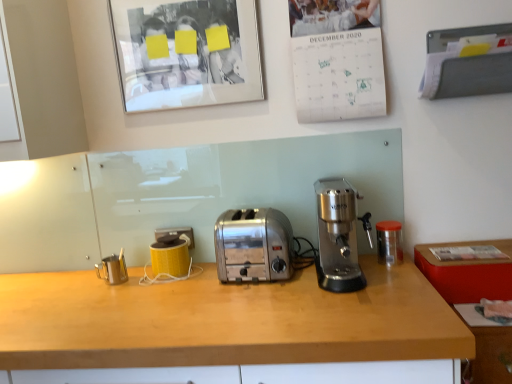
This screenshot has width=512, height=384. Describe the element at coordinates (170, 255) in the screenshot. I see `yellow matte mug at center, the second appliance in the left-to-right sequence` at that location.

Describe the element at coordinates (389, 242) in the screenshot. I see `transparent plastic container at right, arranged as the 1th appliance when viewed from the right` at that location.

The width and height of the screenshot is (512, 384). I want to click on yellow plastic electric outlet at lower left, so click(x=176, y=233).

From a real-world perspective, is satin silver coffee maker at center above or below wooden desk at center?

satin silver coffee maker at center is above wooden desk at center.

Can you tell me how much satin silver coffee maker at center and wooden desk at center differ in facing direction?

They differ by 0.000156 degrees in their facing directions.

Is satin silver coffee maker at center beside wooden desk at center?

satin silver coffee maker at center is not next to wooden desk at center, and they're not touching.

Would you say matte glass picture frame at upper left contains wooden desk at center?

No.

Where is `picture frame on the right of wooden desk at center`? This screenshot has height=384, width=512. picture frame on the right of wooden desk at center is located at coordinates 186,52.

Is matte glass picture frame at upper left thinner than wooden desk at center?

Correct, the width of matte glass picture frame at upper left is less than that of wooden desk at center.

What's the angular difference between matte glass picture frame at upper left and wooden desk at center's facing directions?

0.403 degrees.

From the image's perspective, is yellow plastic electric outlet at lower left over yellow matte mug at center, the second appliance in the left-to-right sequence?

Correct, yellow plastic electric outlet at lower left appears higher than yellow matte mug at center, the second appliance in the left-to-right sequence, in the image.

Which object is positioned more to the left, yellow plastic electric outlet at lower left or yellow matte mug at center, which is the second appliance from right to left?

From the viewer's perspective, yellow plastic electric outlet at lower left appears more on the left side.

In terms of width, does yellow plastic electric outlet at lower left look wider or thinner when compared to yellow matte mug at center, which is the second appliance from right to left?

Considering their sizes, yellow plastic electric outlet at lower left looks slimmer than yellow matte mug at center, which is the second appliance from right to left.

Locate an element on the screen. coffee maker above the yellow matte mug at center, which is the second appliance from right to left (from the image's perspective) is located at coordinates (339, 236).

From a real-world perspective, is yellow matte mug at center, the second appliance in the left-to-right sequence, positioned over satin silver coffee maker at center based on gravity?

Actually, yellow matte mug at center, the second appliance in the left-to-right sequence, is physically below satin silver coffee maker at center in the real world.

Considering the relative positions of yellow matte mug at center, which is the second appliance from right to left, and satin silver coffee maker at center in the image provided, is yellow matte mug at center, which is the second appliance from right to left, to the left of satin silver coffee maker at center from the viewer's perspective?

Correct, you'll find yellow matte mug at center, which is the second appliance from right to left, to the left of satin silver coffee maker at center.

From the image's perspective, who appears lower, yellow matte mug at center, which is the second appliance from right to left, or satin silver coffee maker at center?

yellow matte mug at center, which is the second appliance from right to left, appears lower in the image.

Can you confirm if yellow matte mug at center, the second appliance in the left-to-right sequence, is wider than matte glass picture frame at upper left?

Yes, yellow matte mug at center, the second appliance in the left-to-right sequence, is wider than matte glass picture frame at upper left.

This screenshot has height=384, width=512. Find the location of `appliance that is the 2nd object located behind the matte glass picture frame at upper left`. appliance that is the 2nd object located behind the matte glass picture frame at upper left is located at coordinates point(170,255).

Looking at the image, does yellow matte mug at center, which is the second appliance from right to left, seem bigger or smaller compared to matte glass picture frame at upper left?

Clearly, yellow matte mug at center, which is the second appliance from right to left, is smaller in size than matte glass picture frame at upper left.

Relative to matte glass picture frame at upper left, is yellow matte mug at center, the second appliance in the left-to-right sequence, in front or behind?

Clearly, yellow matte mug at center, the second appliance in the left-to-right sequence, is behind matte glass picture frame at upper left.

From a real-world perspective, is transparent plastic container at right, which ranks as the 3th appliance in left-to-right order, on satin silver coffee maker at center?

Actually, transparent plastic container at right, which ranks as the 3th appliance in left-to-right order, is physically below satin silver coffee maker at center in the real world.

From the picture: Could you measure the distance between transparent plastic container at right, which ranks as the 3th appliance in left-to-right order, and satin silver coffee maker at center?

7.87 inches.

In the scene shown: Is transparent plastic container at right, arranged as the 1th appliance when viewed from the right, taller than satin silver coffee maker at center?

In fact, transparent plastic container at right, arranged as the 1th appliance when viewed from the right, may be shorter than satin silver coffee maker at center.

The image size is (512, 384). In order to click on coffee maker on the left of transparent plastic container at right, which ranks as the 3th appliance in left-to-right order in this screenshot , I will do `click(339, 236)`.

Does point (199, 53) come in front of point (378, 257)?

No.

From a real-world perspective, is matte glass picture frame at upper left physically located above or below transparent plastic container at right, arranged as the 1th appliance when viewed from the right?

From a real-world perspective, matte glass picture frame at upper left is physically above transparent plastic container at right, arranged as the 1th appliance when viewed from the right.

Who is smaller, matte glass picture frame at upper left or transparent plastic container at right, which ranks as the 3th appliance in left-to-right order?

transparent plastic container at right, which ranks as the 3th appliance in left-to-right order.

Where is `picture frame lying on the left of transparent plastic container at right, which ranks as the 3th appliance in left-to-right order`? Image resolution: width=512 pixels, height=384 pixels. picture frame lying on the left of transparent plastic container at right, which ranks as the 3th appliance in left-to-right order is located at coordinates (186, 52).

Where is `coffee maker above the wooden desk at center (from a real-world perspective)`? The width and height of the screenshot is (512, 384). coffee maker above the wooden desk at center (from a real-world perspective) is located at coordinates (339, 236).

Locate an element on the screen. This screenshot has width=512, height=384. picture frame behind the wooden desk at center is located at coordinates (186, 52).

Which object lies further to the anchor point satin chrome toaster at center, wooden desk at center or matte glass picture frame at upper left?

Among the two, matte glass picture frame at upper left is located further to satin chrome toaster at center.

Looking at the image, which one is located further to yellow plastic electric outlet at lower left, transparent plastic container at right, arranged as the 1th appliance when viewed from the right, or satin silver coffee maker at center?

The object further to yellow plastic electric outlet at lower left is transparent plastic container at right, arranged as the 1th appliance when viewed from the right.

Which object lies further to the anchor point satin silver coffee maker at center, yellow matte mug at center, which is the second appliance from right to left, or matte glass picture frame at upper left?

matte glass picture frame at upper left.

Looking at the image, which one is located further to brushed metal milk frother at left, the third appliance positioned from the right, wooden desk at center or transparent plastic container at right, which ranks as the 3th appliance in left-to-right order?

Among the two, transparent plastic container at right, which ranks as the 3th appliance in left-to-right order, is located further to brushed metal milk frother at left, the third appliance positioned from the right.

Which object lies nearer to the anchor point yellow matte mug at center, the second appliance in the left-to-right sequence, wooden countertop at lower right or yellow plastic electric outlet at lower left?

Among the two, yellow plastic electric outlet at lower left is located nearer to yellow matte mug at center, the second appliance in the left-to-right sequence.

Estimate the real-world distances between objects in this image. Which object is closer to yellow plastic electric outlet at lower left, wooden desk at center or matte glass picture frame at upper left?

wooden desk at center is positioned closer to the anchor yellow plastic electric outlet at lower left.

Considering their positions, is matte glass picture frame at upper left positioned closer to satin chrome toaster at center than yellow plastic electric outlet at lower left?

Among the two, yellow plastic electric outlet at lower left is located nearer to satin chrome toaster at center.

Estimate the real-world distances between objects in this image. Which object is further from satin silver coffee maker at center, satin chrome toaster at center or yellow plastic electric outlet at lower left?

yellow plastic electric outlet at lower left is positioned further to the anchor satin silver coffee maker at center.

Where is `desk between yellow matte mug at center, the second appliance in the left-to-right sequence, and transparent plastic container at right, which ranks as the 3th appliance in left-to-right order, in the horizontal direction`? The image size is (512, 384). desk between yellow matte mug at center, the second appliance in the left-to-right sequence, and transparent plastic container at right, which ranks as the 3th appliance in left-to-right order, in the horizontal direction is located at coordinates (227, 327).

Find the location of a particular element. The image size is (512, 384). desk between brushed metal milk frother at left, the third appliance positioned from the right, and wooden countertop at lower right from left to right is located at coordinates (227, 327).

The image size is (512, 384). I want to click on toaster situated between yellow matte mug at center, the second appliance in the left-to-right sequence, and satin silver coffee maker at center from left to right, so click(253, 245).

Locate an element on the screen. toaster situated between wooden desk at center and satin silver coffee maker at center from left to right is located at coordinates (253, 245).